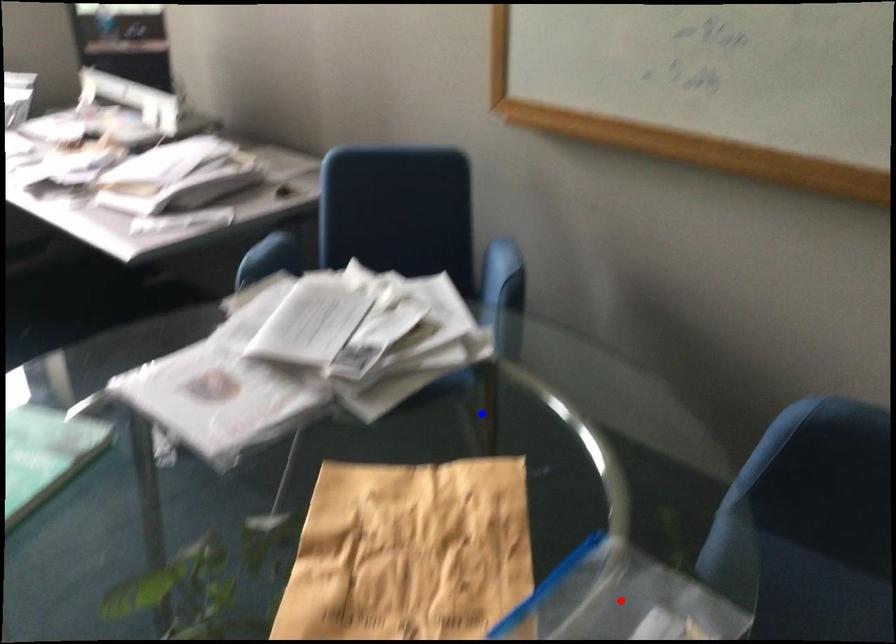
Question: In the image, two points are highlighted. Which point is nearer to the camera? Reply with the corresponding letter.

Choices:
 (A) blue point
 (B) red point

Answer: (B)